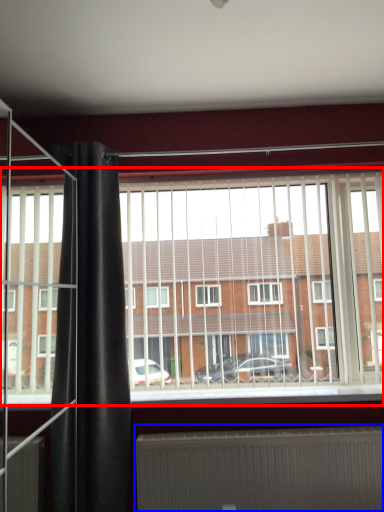
Question: Which object is further to the camera taking this photo, window (highlighted by a red box) or radiator (highlighted by a blue box)?

Choices:
 (A) window
 (B) radiator

Answer: (A)